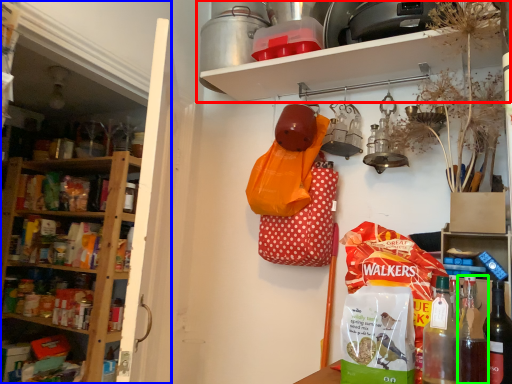
Question: Estimate the real-world distances between objects in this image. Which object is farther from shelf (highlighted by a red box), shelf (highlighted by a blue box) or bottle (highlighted by a green box)?

Choices:
 (A) shelf
 (B) bottle

Answer: (A)